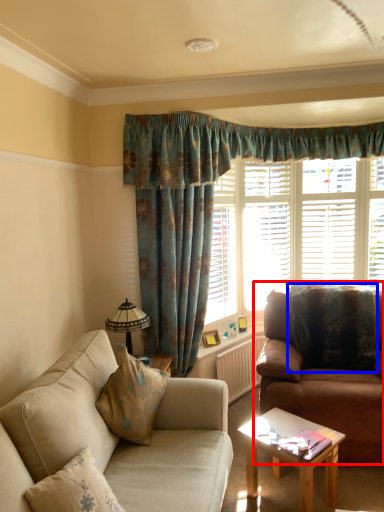
Question: Which of the following is the closest to the observer, studio couch (highlighted by a red box) or pillow (highlighted by a blue box)?

Choices:
 (A) studio couch
 (B) pillow

Answer: (A)